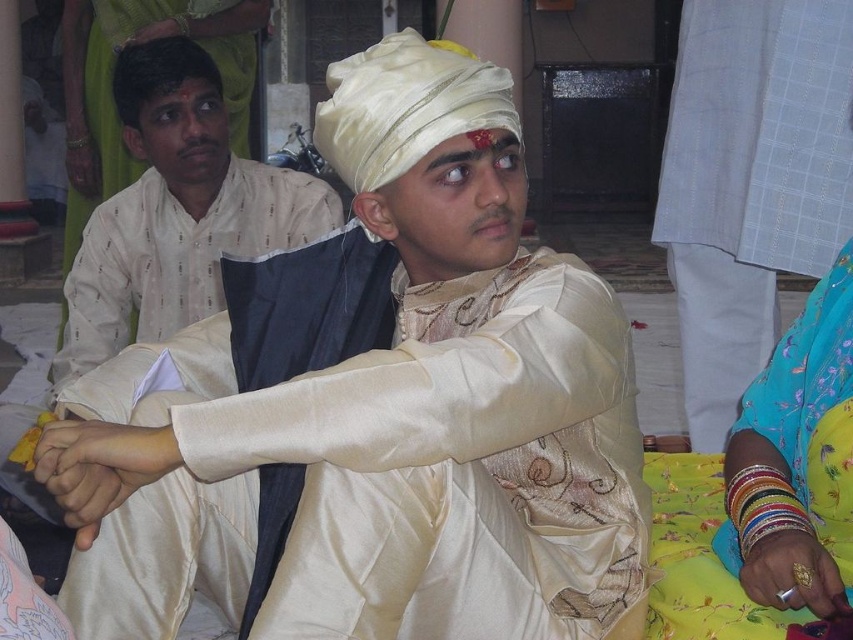
You are a tailor observing a cultural ceremony and notice two attendees wearing the matte cream kurta at center and the matte beige kurta at left. Which kurta would require more fabric to make, and why?

The matte cream kurta at center would require more fabric because it is bigger than the matte beige kurta at left.

In the scene shown: Looking at the scene from a cultural ceremony, you notice the satin white turban at center and the multicolored bangles at lower right. Which object is positioned higher up in the image?

The satin white turban at center is higher up than the multicolored bangles at lower right because it is shorter in height.